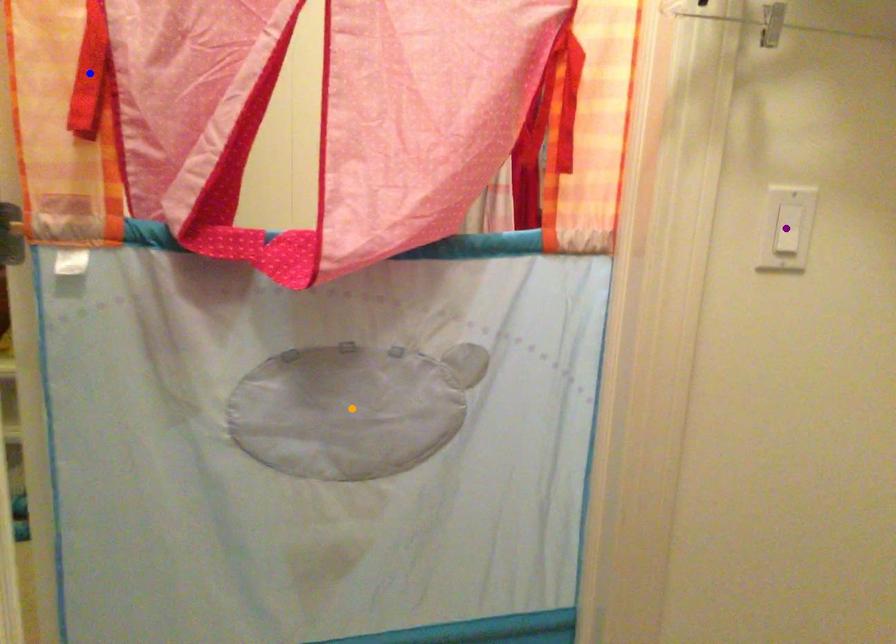
Order these from nearest to farthest:
1. purple point
2. orange point
3. blue point

1. orange point
2. purple point
3. blue point